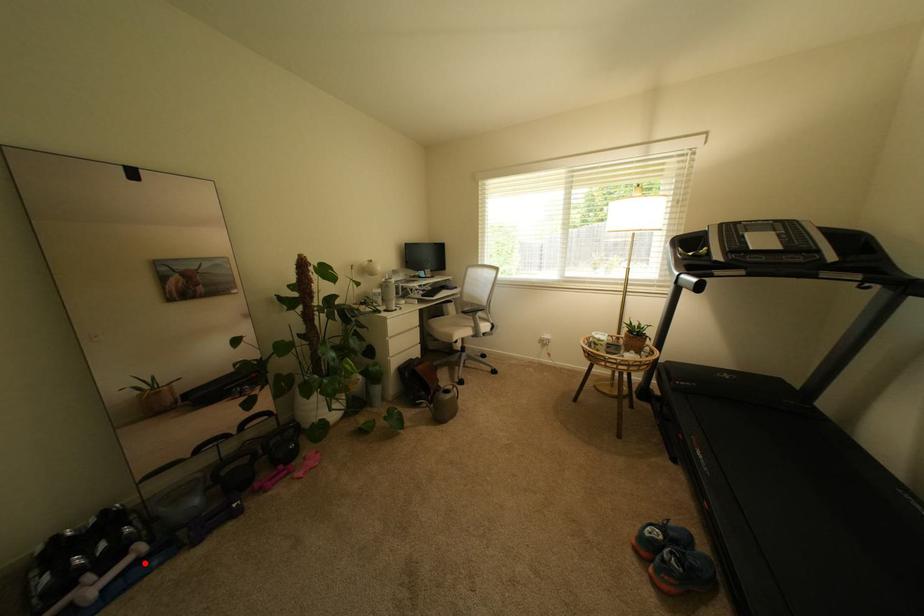
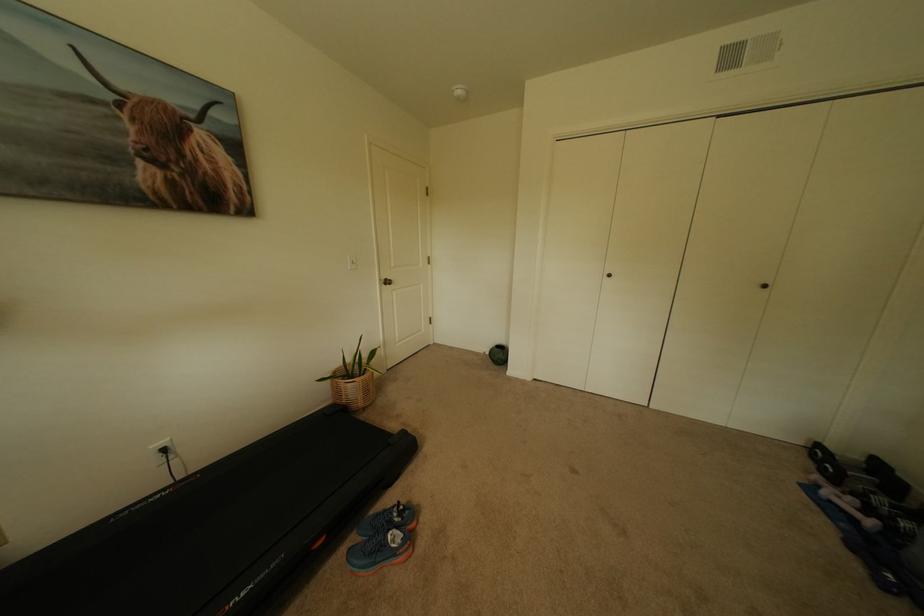
Where in the second image is the point corresponding to the highlighted location from the first image?

(862, 521)